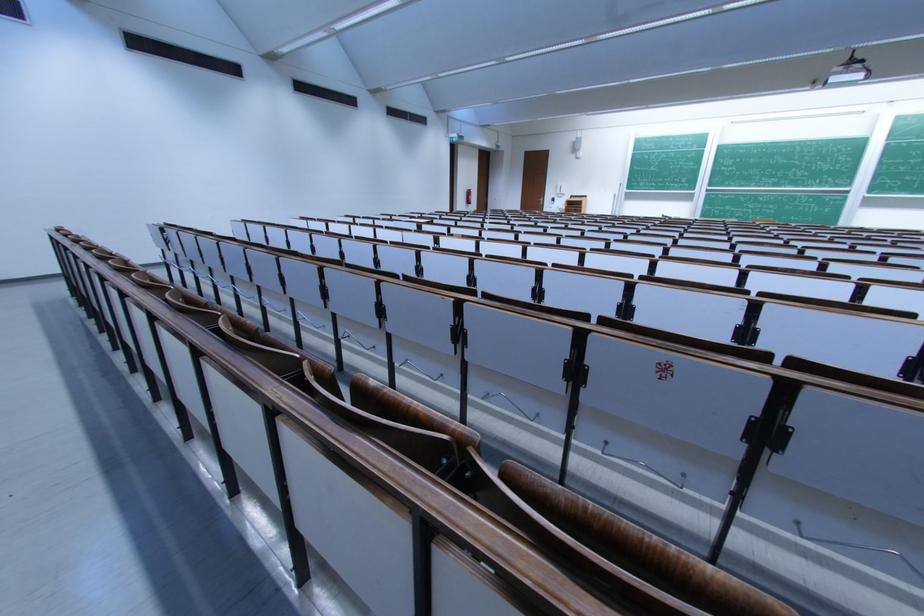
Locate an element on the screen. The height and width of the screenshot is (616, 924). fire extinguisher handle is located at coordinates (468, 196).